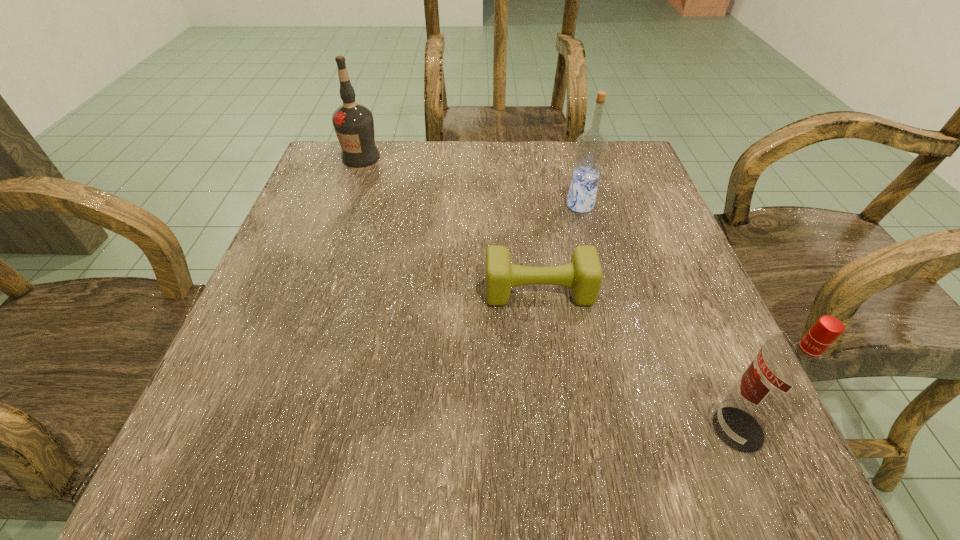
Identify the location of the second farthest vodka. (591, 147).

Where is `the second vodka from right to left`? The width and height of the screenshot is (960, 540). the second vodka from right to left is located at coordinates (591, 147).

At what (x,y) coordinates should I click in order to perform the action: click on the farthest vodka. Please return your answer as a coordinate pair (x, y). Image resolution: width=960 pixels, height=540 pixels. Looking at the image, I should click on (353, 123).

Locate an element on the screen. Image resolution: width=960 pixels, height=540 pixels. the leftmost object is located at coordinates (353, 123).

Locate an element on the screen. the nearest object is located at coordinates (789, 373).

You are a GUI agent. You are given a task and a screenshot of the screen. Output one action in this format:
    pyautogui.click(x=<x>, y=<y>)
    Task: Click on the rightmost vodka
    This screenshot has height=540, width=960.
    Given the screenshot: What is the action you would take?
    pyautogui.click(x=789, y=373)

Locate an element on the screen. Image resolution: width=960 pixels, height=540 pixels. the second nearest object is located at coordinates [583, 275].

You are a GUI agent. You are given a task and a screenshot of the screen. Output one action in this format:
    pyautogui.click(x=<x>, y=<y>)
    Task: Click on the shortest object
    
    Given the screenshot: What is the action you would take?
    pyautogui.click(x=583, y=275)

The height and width of the screenshot is (540, 960). What are the coordinates of `free location located 0.370m on the front of the second farthest object` in the screenshot? It's located at (623, 371).

Image resolution: width=960 pixels, height=540 pixels. What are the coordinates of `blank space located 0.290m on the front label of the leftmost object` in the screenshot? It's located at (327, 254).